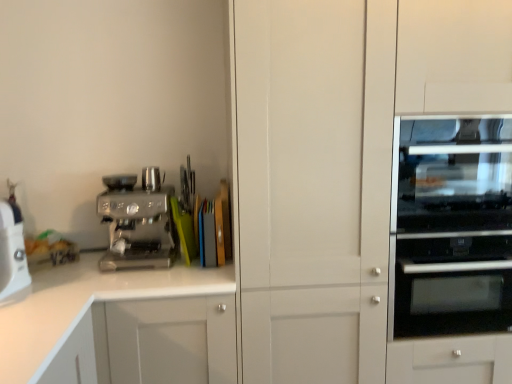
What do you see at coordinates (12, 252) in the screenshot? I see `white plastic food processor at left` at bounding box center [12, 252].

Find the location of a particular element. Image resolution: width=512 pixels, height=384 pixels. white plastic food processor at left is located at coordinates (12, 252).

Between transparent glass oven at right and white plastic food processor at left, which one appears on the right side from the viewer's perspective?

transparent glass oven at right.

In the image, there is a white plastic food processor at left. Identify the location of glass door above it (from the image's perspective). (314, 186).

Is point (292, 64) closer to camera compared to point (19, 242)?

Yes, it is in front of point (19, 242).

In the scene shown: Can you confirm if transparent glass oven at right is taller than white plastic food processor at left?

Indeed, transparent glass oven at right has a greater height compared to white plastic food processor at left.

Is white glossy cabinet at lower left positioned with its back to white plastic food processor at left?

Result: No.

Is white glossy cabinet at lower left positioned beyond the bounds of white plastic food processor at left?

Yes, white glossy cabinet at lower left is not within white plastic food processor at left.

Identify the location of cabinetry behind the white plastic food processor at left. The height and width of the screenshot is (384, 512). (84, 304).

Which is behind, point (12, 366) or point (20, 211)?

Positioned behind is point (20, 211).

Between white glossy cabinet at lower left and satin chrome espresso machine at left, which one is positioned behind?

Positioned behind is satin chrome espresso machine at left.

Does point (3, 331) lie in front of point (117, 194)?

Yes, it is in front of point (117, 194).

Is white glossy cabinet at lower left looking in the opposite direction of satin chrome espresso machine at left?

No, white glossy cabinet at lower left's orientation is not away from satin chrome espresso machine at left.

Who is taller, white glossy cabinet at lower left or satin chrome espresso machine at left?

With more height is white glossy cabinet at lower left.

Can you tell me how much white plastic food processor at left and satin chrome espresso machine at left differ in facing direction?

The angular difference between white plastic food processor at left and satin chrome espresso machine at left is 68.5 degrees.

Which object is thinner, white plastic food processor at left or satin chrome espresso machine at left?

white plastic food processor at left is thinner.

Is white plastic food processor at left next to satin chrome espresso machine at left?

No, white plastic food processor at left is not touching satin chrome espresso machine at left.

Which of these two, white plastic food processor at left or white glossy cabinet at lower left, is thinner?

With smaller width is white plastic food processor at left.

Is white plastic food processor at left not inside white glossy cabinet at lower left?

Indeed, white plastic food processor at left is completely outside white glossy cabinet at lower left.

Identify the location of home appliance above the white glossy cabinet at lower left (from a real-world perspective). (12, 252).

Are white plastic food processor at left and white glossy cabinet at lower left beside each other?

No, white plastic food processor at left is not making contact with white glossy cabinet at lower left.

Are black glass oven at right and white plastic food processor at left far apart?

Yes, black glass oven at right and white plastic food processor at left are located far from each other.

Which is in front, black glass oven at right or white plastic food processor at left?

white plastic food processor at left is in front.

Who is bigger, black glass oven at right or white plastic food processor at left?

With larger size is black glass oven at right.

Looking at this image, considering the positions of objects black glass oven at right and white plastic food processor at left in the image provided, who is more to the right, black glass oven at right or white plastic food processor at left?

black glass oven at right.

Is transparent glass oven at right spatially inside white glossy cabinet at lower left, or outside of it?

The correct answer is: outside.

Considering the relative sizes of transparent glass oven at right and white glossy cabinet at lower left in the image provided, is transparent glass oven at right wider than white glossy cabinet at lower left?

Yes, transparent glass oven at right is wider than white glossy cabinet at lower left.

Is point (251, 280) farther from viewer compared to point (32, 355)?

Yes.

Is transparent glass oven at right with white glossy cabinet at lower left?

There is a gap between transparent glass oven at right and white glossy cabinet at lower left.

Identify the location of glass door directly beneath the white plastic food processor at left (from a real-world perspective). The height and width of the screenshot is (384, 512). (314, 186).

Identify the location of cabinetry lying below the white plastic food processor at left (from the image's perspective). (84, 304).

Considering their positions, is white plastic food processor at left positioned closer to transparent glass oven at right than black glass oven at right?

Among the two, black glass oven at right is located nearer to transparent glass oven at right.

Based on their spatial positions, is transparent glass oven at right or satin chrome espresso machine at left closer to white plastic food processor at left?

satin chrome espresso machine at left lies closer to white plastic food processor at left than the other object.

Estimate the real-world distances between objects in this image. Which object is further from white glossy cabinet at lower left, black glass oven at right or transparent glass oven at right?

black glass oven at right is further to white glossy cabinet at lower left.

Which object lies nearer to the anchor point transparent glass oven at right, black glass oven at right or white glossy cabinet at lower left?

black glass oven at right is closer to transparent glass oven at right.

Considering their positions, is white plastic food processor at left positioned further to white glossy cabinet at lower left than satin chrome espresso machine at left?

white plastic food processor at left lies further to white glossy cabinet at lower left than the other object.

Based on their spatial positions, is satin chrome espresso machine at left or transparent glass oven at right further from black glass oven at right?

satin chrome espresso machine at left is further to black glass oven at right.

Estimate the real-world distances between objects in this image. Which object is further from white plastic food processor at left, white glossy cabinet at lower left or transparent glass oven at right?

transparent glass oven at right.

When comparing their distances from transparent glass oven at right, does satin chrome espresso machine at left or white plastic food processor at left seem further?

white plastic food processor at left is further to transparent glass oven at right.

What are the coordinates of `cabinetry situated between white plastic food processor at left and transparent glass oven at right from left to right` in the screenshot? It's located at pos(84,304).

Locate an element on the screen. kitchen appliance between white plastic food processor at left and black glass oven at right in the horizontal direction is located at coordinates (137, 222).

You are a GUI agent. You are given a task and a screenshot of the screen. Output one action in this format:
    pyautogui.click(x=<x>, y=<y>)
    Task: Click on the glass door between white plastic food processor at left and black glass oven at right in the horizontal direction
    The width and height of the screenshot is (512, 384).
    Given the screenshot: What is the action you would take?
    (314, 186)

The height and width of the screenshot is (384, 512). I want to click on kitchen appliance between white plastic food processor at left and transparent glass oven at right, so click(137, 222).